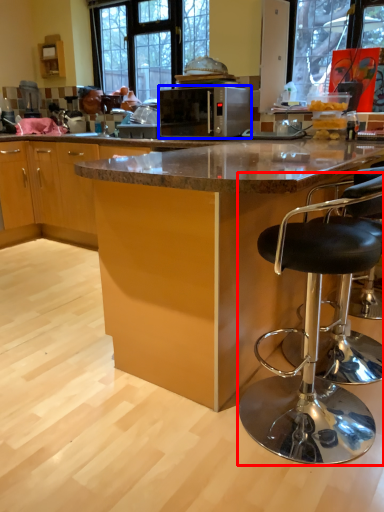
Question: Which of the following is the closest to the observer, chair (highlighted by a red box) or microwave oven (highlighted by a blue box)?

Choices:
 (A) chair
 (B) microwave oven

Answer: (A)